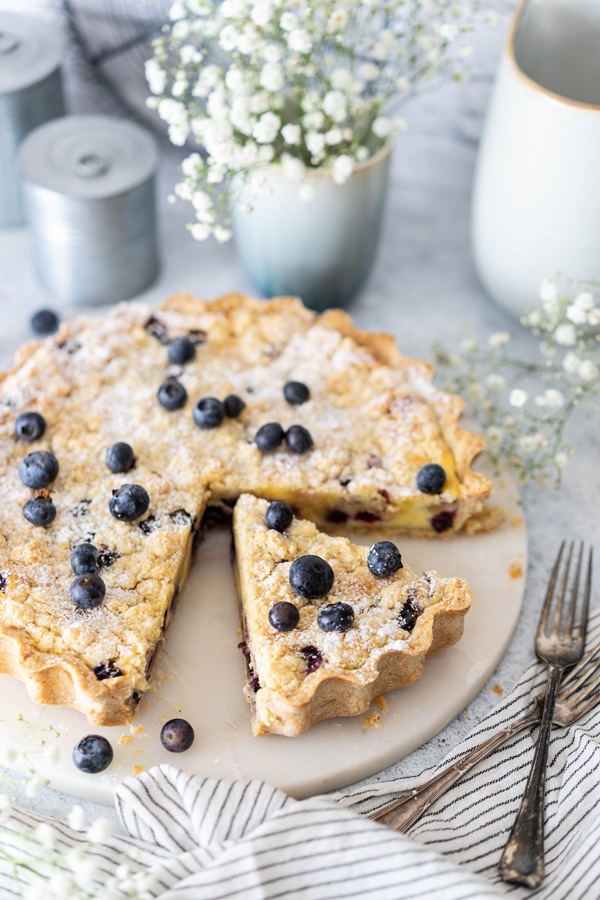
Locate an element on the screen. The width and height of the screenshot is (600, 900). rim of vase is located at coordinates (375, 159).